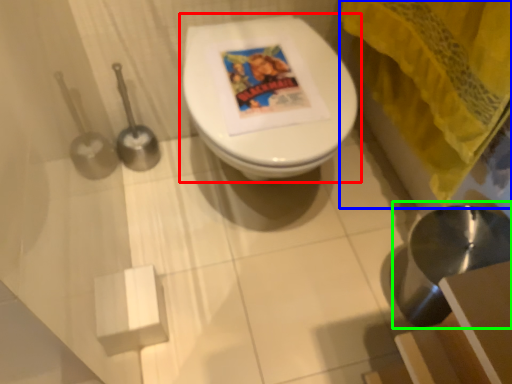
Question: Which object is the farthest from toilet (highlighted by a red box)? Choose among these: curtain (highlighted by a blue box) or sink (highlighted by a green box).

Choices:
 (A) curtain
 (B) sink

Answer: (B)